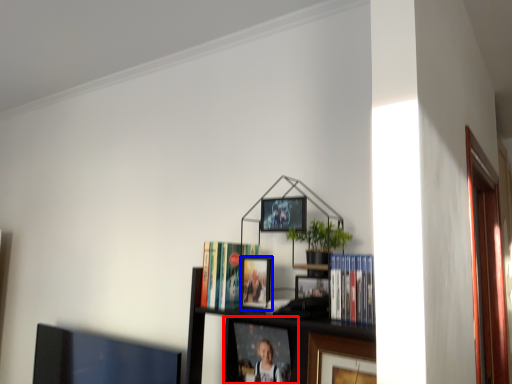
Question: Which object appears closest to the camera in this image, picture frame (highlighted by a red box) or picture frame (highlighted by a blue box)?

Choices:
 (A) picture frame
 (B) picture frame

Answer: (B)